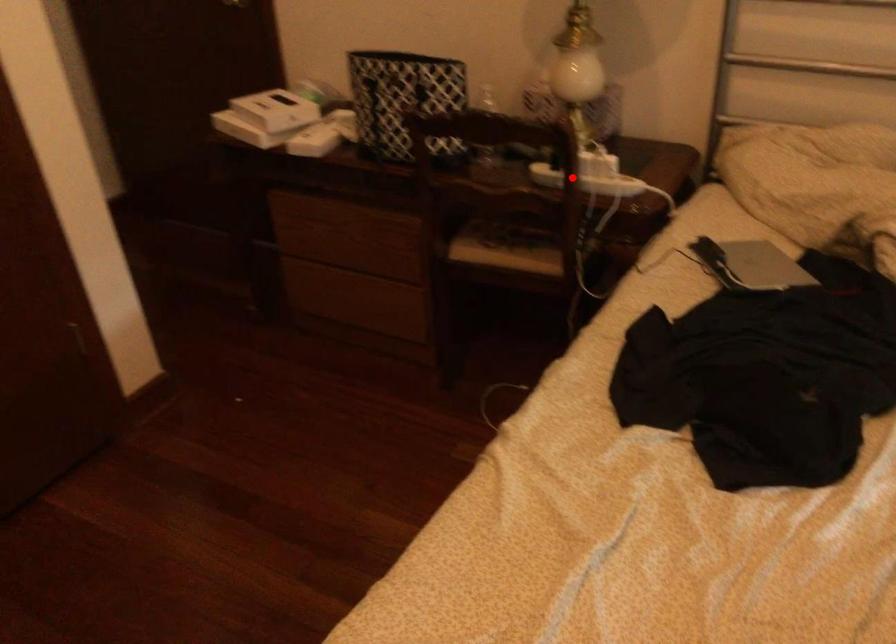
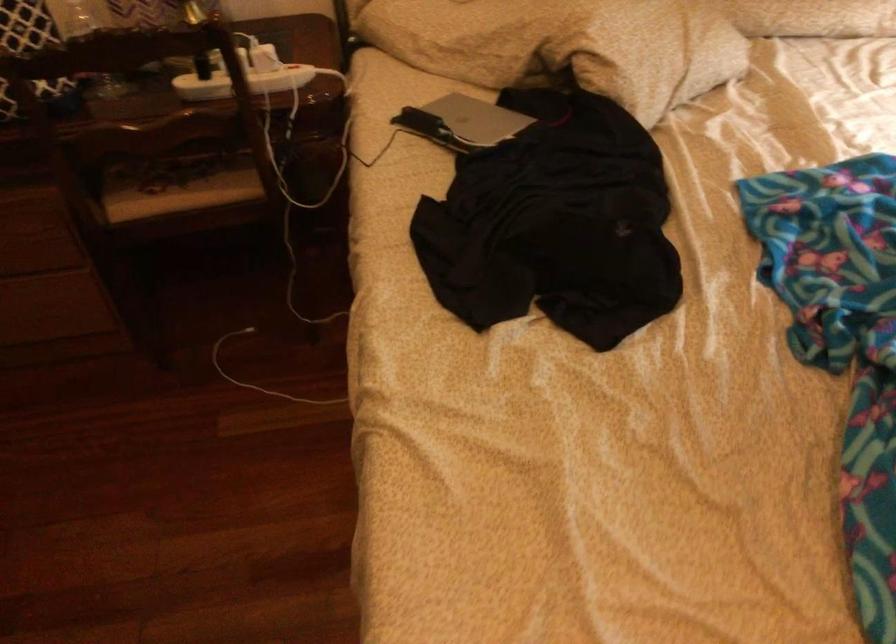
Question: A red point is marked in image1. In image2, is the corresponding 3D point closer to the camera or farther? Reply with the corresponding letter.

Choices:
 (A) The corresponding 3D point is closer.
 (B) The corresponding 3D point is farther.

Answer: (A)